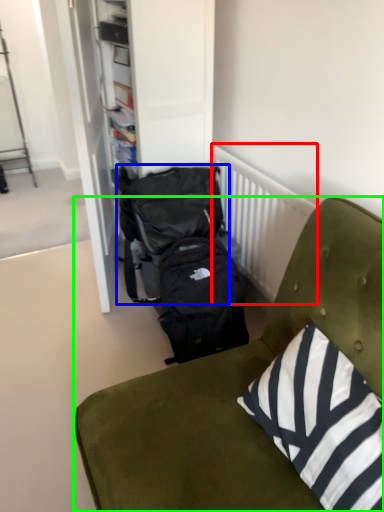
Question: Which object is the closest to the radiator (highlighted by a red box)? Choose among these: backpack (highlighted by a blue box) or furniture (highlighted by a green box).

Choices:
 (A) backpack
 (B) furniture

Answer: (A)